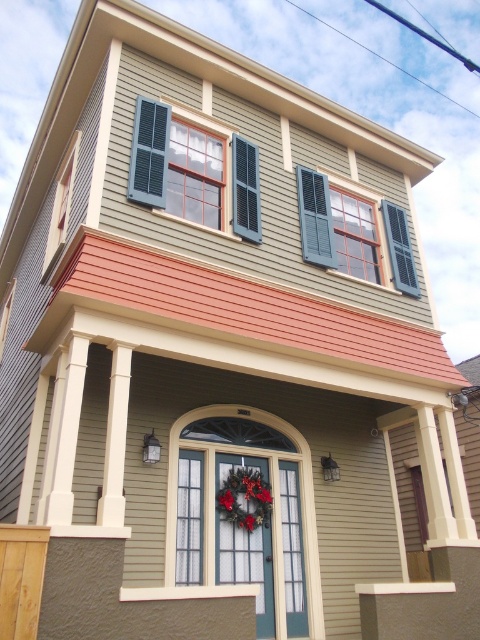
Which of these two, smooth wood porch at center or matte blue shutters at upper center, stands taller?

Standing taller between the two is matte blue shutters at upper center.

Which is below, smooth wood porch at center or matte blue shutters at upper center?

smooth wood porch at center

Measure the distance between point (126,545) and camera.

Point (126,545) is 6.15 meters from camera.

Identify the location of smooth wood porch at center. The image size is (480, 640). (229, 449).

Is point (348, 257) positioned before point (257, 493)?

No, (348, 257) is behind (257, 493).

Is matte blue shutters at upper center taller than green fabric wreath at center?

Indeed, matte blue shutters at upper center has a greater height compared to green fabric wreath at center.

What do you see at coordinates (336, 227) in the screenshot?
I see `matte blue shutters at upper center` at bounding box center [336, 227].

Find the location of a particular element. This screenshot has width=480, height=640. matte blue shutters at upper center is located at coordinates (336, 227).

Can you confirm if smooth wood porch at center is wider than green fabric wreath at center?

In fact, smooth wood porch at center might be narrower than green fabric wreath at center.

Does smooth wood porch at center come behind green fabric wreath at center?

No.

Does point (2, 488) lie behind point (226, 493)?

Yes, it is behind point (226, 493).

You are a GUI agent. You are given a task and a screenshot of the screen. Output one action in this format:
    pyautogui.click(x=<x>, y=<y>)
    Task: Click on the smooth wood porch at center
    
    Given the screenshot: What is the action you would take?
    click(229, 449)